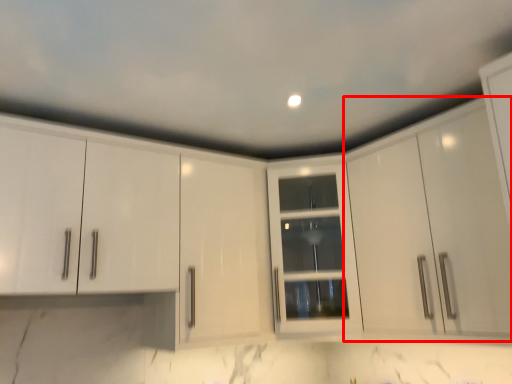
Question: From the image's perspective, what is the correct spatial relationship of cabinetry (annotated by the red box) in relation to cabinetry?

Choices:
 (A) above
 (B) below

Answer: (A)